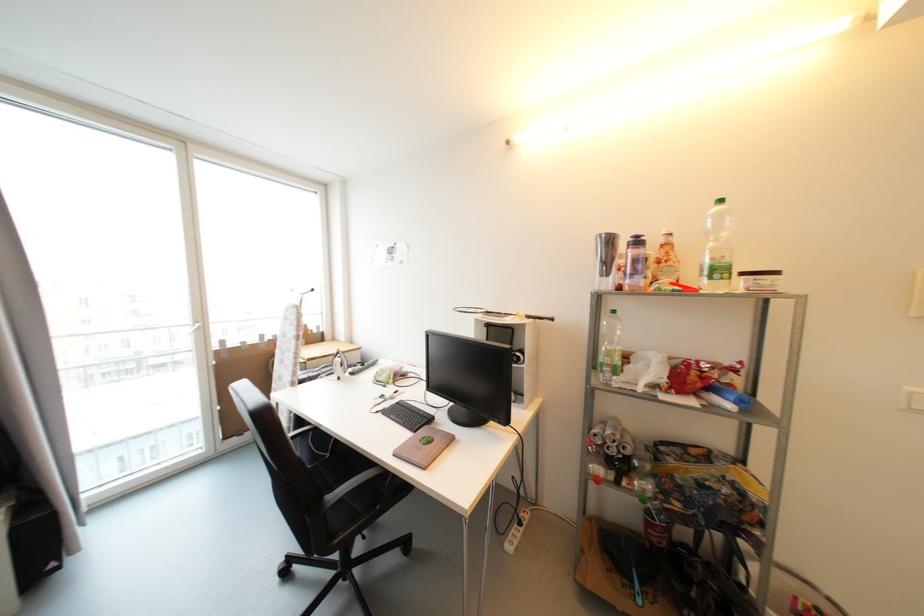
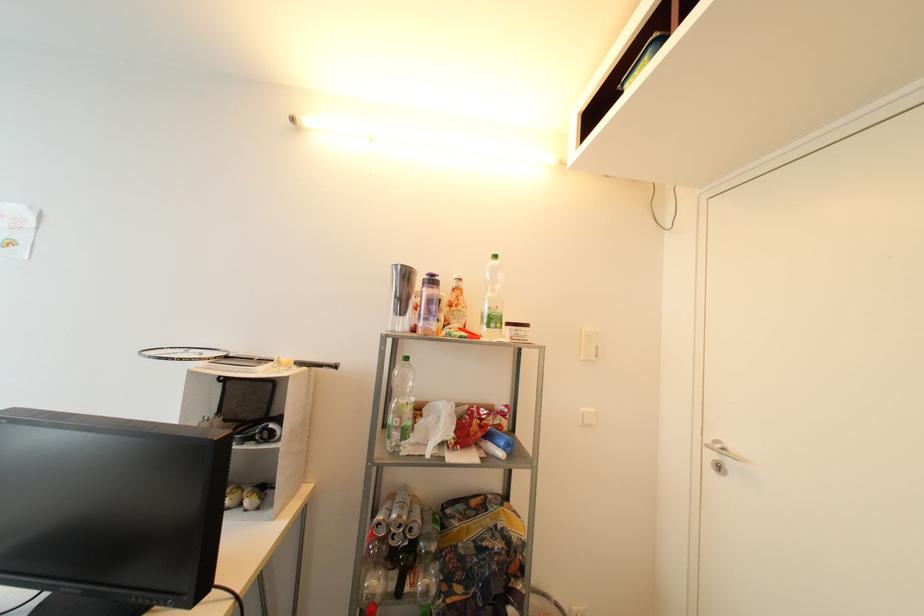
Locate, in the second image, the point that corresponds to (612,236) in the first image.

(407, 268)